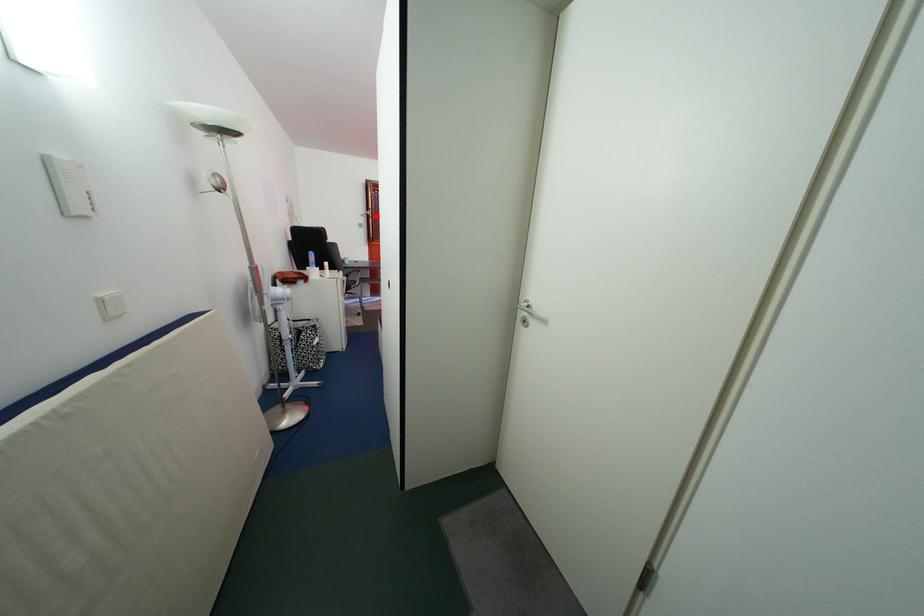
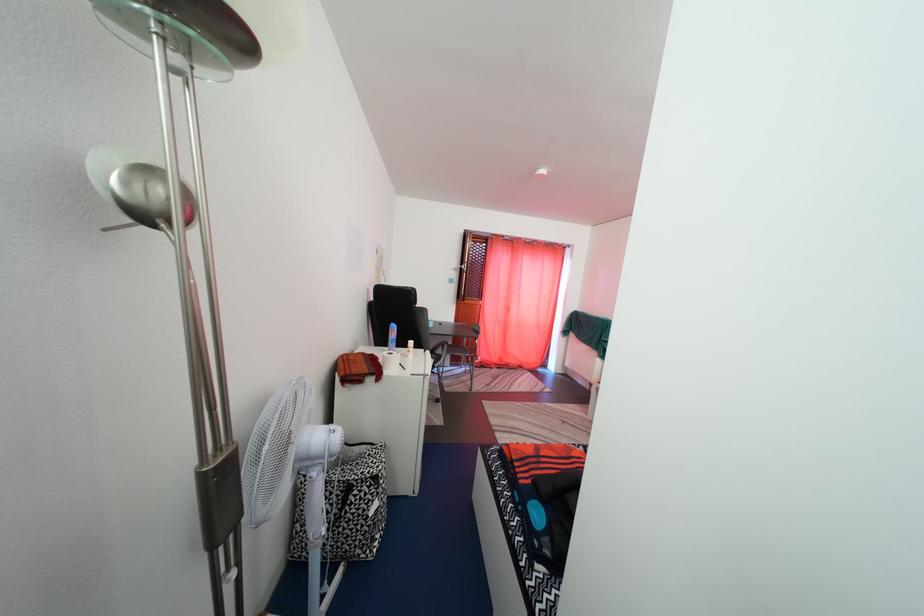
Question: I am providing you with two images of the same scene from different viewpoints. In image1, a red point is highlighted. Considering the same 3D point in image2, which of the following is correct?

Choices:
 (A) It is closer
 (B) It is farther

Answer: (B)